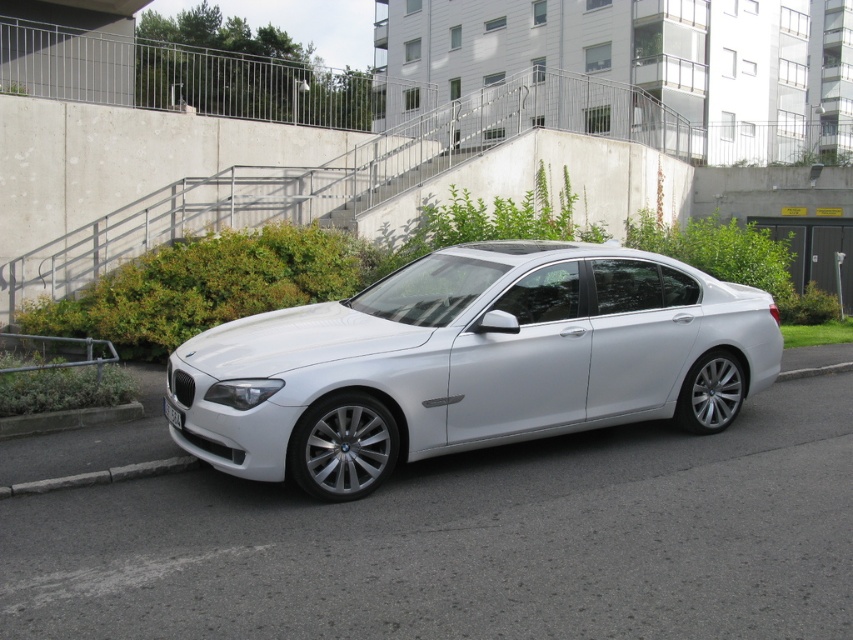
You are a delivery person who needs to park your vehicle in a space that requires clearance of 1.8 meters. Based on the image, can you determine if the white metallic car at center and the white plastic license plate at lower center will allow enough clearance?

The white metallic car at center is taller than the white plastic license plate at lower center. Since the license plate is part of the car, the car itself is taller than the required clearance. Therefore, the white metallic car at center may not fit into the parking space with 1.8 meters clearance.